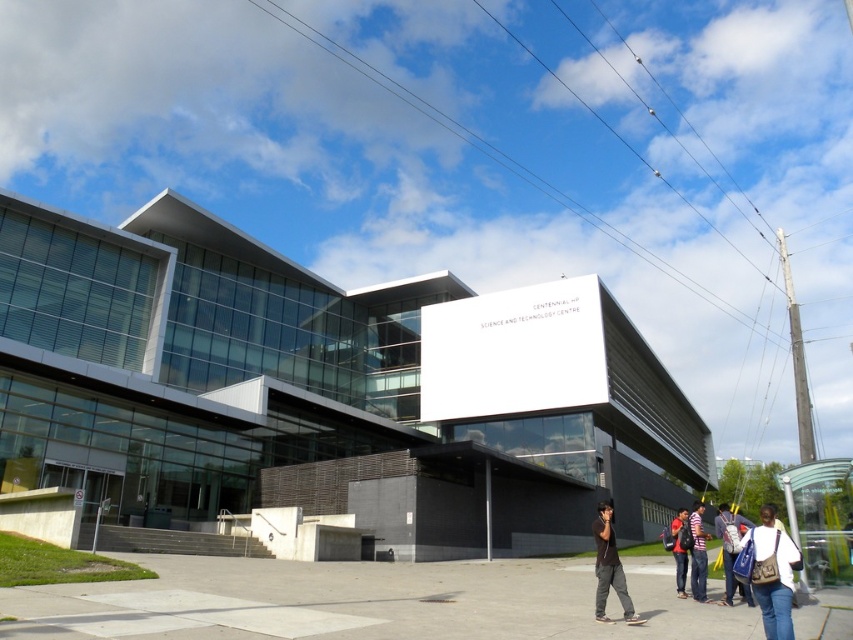
You are standing at the entrance of the modern building and want to determine which of the two points, point (752, 563) or point (717, 515), is closer to you. Based on the image, which point is nearer?

Point (752, 563) is closer to the viewer than point (717, 515).

You are standing at the entrance of the modern building and see the point at coordinates (730, 552). What object is located at that point?

The point at coordinates (730, 552) corresponds to the blue fabric bag at lower right.